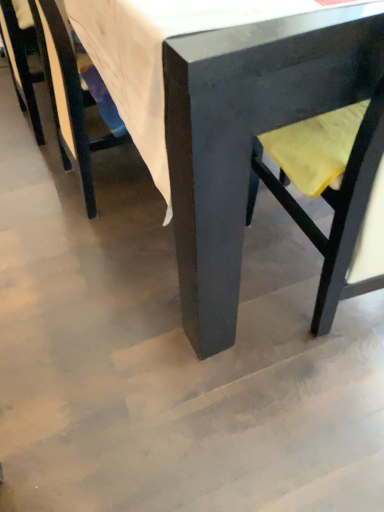
Question: In terms of width, does matte black chair at lower left, which is the second chair from right to left, look wider or thinner when compared to matte black chair at center, which is counted as the 3th chair, starting from the left?

Choices:
 (A) thin
 (B) wide

Answer: (A)

Question: Considering their positions, is matte black chair at lower left, which is the second chair in left-to-right order, located in front of or behind matte black chair at center, the 1th chair positioned from the right?

Choices:
 (A) front
 (B) behind

Answer: (B)

Question: Which of these objects is positioned farthest from the matte black chair at left, positioned as the first chair in left-to-right order?

Choices:
 (A) yellow fabric swivel chair at right
 (B) matte black chair at center, the 1th chair positioned from the right
 (C) matte black chair at lower left, which is the second chair in left-to-right order

Answer: (B)

Question: Estimate the real-world distances between objects in this image. Which object is closer to the matte black chair at left, the 3th chair when ordered from right to left?

Choices:
 (A) matte black chair at center, which is counted as the 3th chair, starting from the left
 (B) yellow fabric swivel chair at right
 (C) matte black chair at lower left, which is the second chair from right to left

Answer: (C)